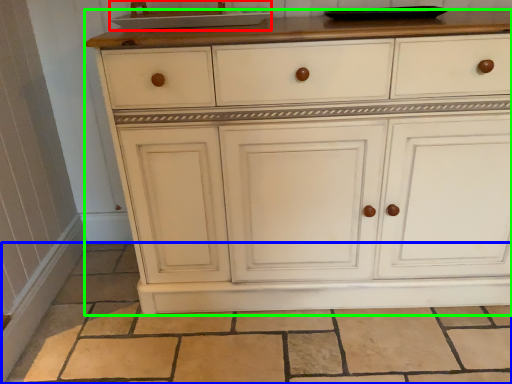
Question: Estimate the real-world distances between objects in this image. Which object is farther from sink (highlighted by a red box), tile (highlighted by a blue box) or chest of drawers (highlighted by a green box)?

Choices:
 (A) tile
 (B) chest of drawers

Answer: (A)